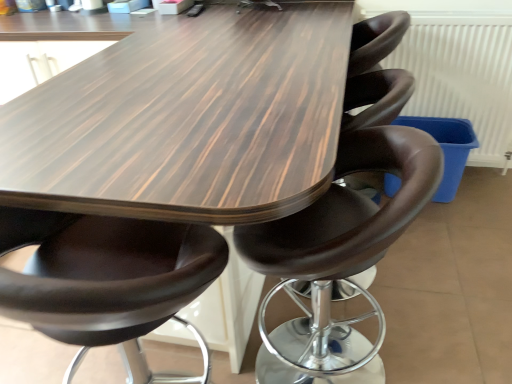
Question: From a real-world perspective, is matte brown leather chair at center, which is the second chair from right to left, on brown leather stool at center, which ranks as the 1th chair in right-to-left order?

Choices:
 (A) no
 (B) yes

Answer: (B)

Question: From the image's perspective, is matte brown leather chair at center, the first chair viewed from the left, beneath brown leather stool at center, acting as the 2th chair starting from the left?

Choices:
 (A) no
 (B) yes

Answer: (B)

Question: Does matte brown leather chair at center, the first chair viewed from the left, have a greater width compared to brown leather stool at center, acting as the 2th chair starting from the left?

Choices:
 (A) yes
 (B) no

Answer: (A)

Question: Does matte brown leather chair at center, which is the second chair from right to left, have a lesser width compared to brown leather stool at center, acting as the 2th chair starting from the left?

Choices:
 (A) yes
 (B) no

Answer: (B)

Question: Does matte brown leather chair at center, which is the second chair from right to left, turn towards brown leather stool at center, which ranks as the 1th chair in right-to-left order?

Choices:
 (A) no
 (B) yes

Answer: (A)

Question: Would you say matte brown leather chair at center, the first chair viewed from the left, is inside or outside wooden table at center?

Choices:
 (A) inside
 (B) outside

Answer: (A)

Question: Is matte brown leather chair at center, the first chair viewed from the left, in front of or behind wooden table at center in the image?

Choices:
 (A) behind
 (B) front

Answer: (B)

Question: In the image, is matte brown leather chair at center, the first chair viewed from the left, on the left side or the right side of wooden table at center?

Choices:
 (A) right
 (B) left

Answer: (B)

Question: From the image's perspective, is matte brown leather chair at center, which is the second chair from right to left, located above or below wooden table at center?

Choices:
 (A) above
 (B) below

Answer: (B)

Question: Considering their positions, is wooden table at center located in front of or behind white textured radiator at upper right?

Choices:
 (A) behind
 (B) front

Answer: (B)

Question: From a real-world perspective, relative to white textured radiator at upper right, is wooden table at center vertically above or below?

Choices:
 (A) below
 (B) above

Answer: (A)

Question: From the image's perspective, relative to white textured radiator at upper right, is wooden table at center above or below?

Choices:
 (A) above
 (B) below

Answer: (B)

Question: Does point (226, 157) appear closer or farther from the camera than point (503, 44)?

Choices:
 (A) farther
 (B) closer

Answer: (B)

Question: Is matte brown leather chair at center, the first chair viewed from the left, bigger or smaller than brown leather stool at center, which ranks as the 1th chair in right-to-left order?

Choices:
 (A) big
 (B) small

Answer: (A)

Question: In terms of width, does matte brown leather chair at center, the first chair viewed from the left, look wider or thinner when compared to brown leather stool at center, acting as the 2th chair starting from the left?

Choices:
 (A) thin
 (B) wide

Answer: (B)